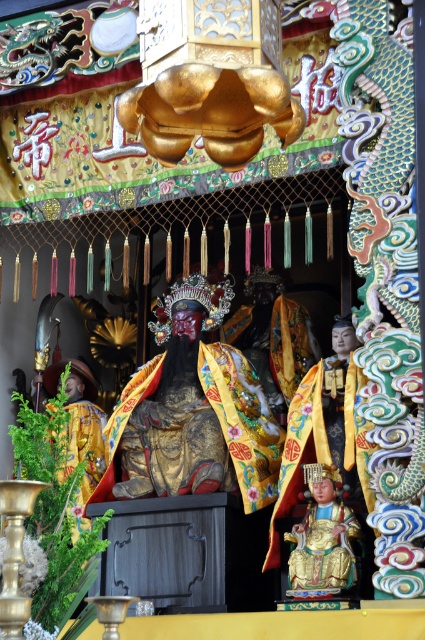
Question: Which point is closer to the camera taking this photo?

Choices:
 (A) (127, 385)
 (B) (317, 497)

Answer: (B)

Question: Which of the following is the farthest from the observer?

Choices:
 (A) gold brocade robe at center
 (B) gold lacquered statue at lower center

Answer: (A)

Question: Does gold brocade robe at center have a lesser width compared to gold lacquered statue at lower center?

Choices:
 (A) no
 (B) yes

Answer: (A)

Question: Is gold brocade robe at center bigger than gold lacquered statue at lower center?

Choices:
 (A) no
 (B) yes

Answer: (B)

Question: Does gold brocade robe at center appear under gold lacquered statue at lower center?

Choices:
 (A) no
 (B) yes

Answer: (A)